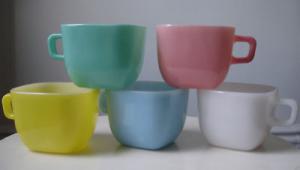
I want to click on white cup, so click(x=252, y=109).